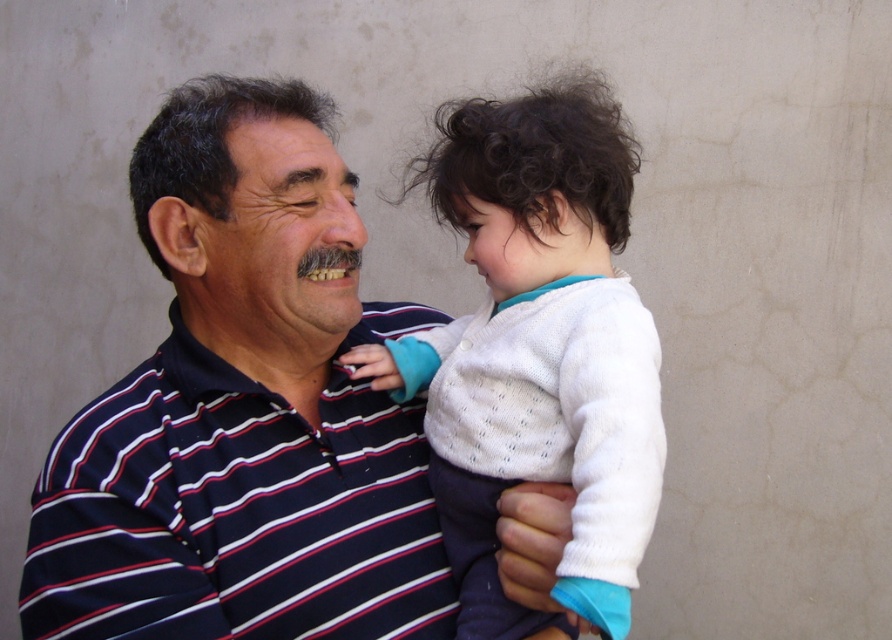
You are a fashion designer observing this image. You need to determine the layering order of the striped cotton shirt at center and the white knit sweater at center. Which one is visible on top?

The white knit sweater at center is behind the striped cotton shirt at center, so the striped cotton shirt at center is visible on top.

You are a tailor who needs to adjust the length of the striped cotton shirt at center and the white knit sweater at center to make them the same length. Which garment should you lengthen and which should you shorten?

The striped cotton shirt at center is shorter than the white knit sweater at center, so you should lengthen the striped cotton shirt at center and shorten the white knit sweater at center to make them the same length.

You are a fashion designer observing the image. You need to determine the layering order of the striped cotton shirt at center and the white knit sweater at center. Which one is visible on top?

The striped cotton shirt at center is below the white knit sweater at center, so the white knit sweater at center is visible on top.